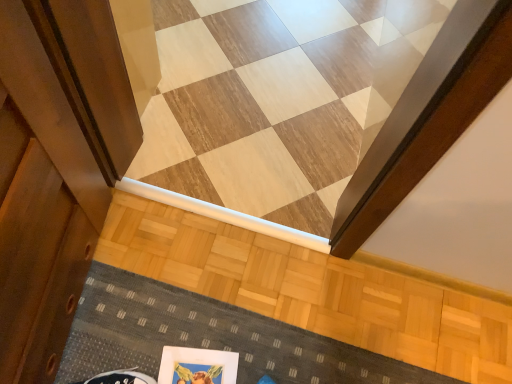
Locate an element on the screen. The width and height of the screenshot is (512, 384). matte white picture frame at lower center is located at coordinates (197, 366).

Measure the distance between textured gray doormat at lower center and camera.

textured gray doormat at lower center is 1.11 meters away from camera.

Where is `wooden floor at center`? Image resolution: width=512 pixels, height=384 pixels. wooden floor at center is located at coordinates (428, 116).

In the scene shown: Could you tell me if matte white picture frame at lower center is turned towards textured gray doormat at lower center?

Yes, matte white picture frame at lower center is facing textured gray doormat at lower center.

Is the depth of matte white picture frame at lower center less than that of textured gray doormat at lower center?

Yes, matte white picture frame at lower center is in front of textured gray doormat at lower center.

Between point (229, 367) and point (80, 374), which one is positioned in front?

Point (80, 374)

From a real-world perspective, is matte white picture frame at lower center physically located above or below textured gray doormat at lower center?

In terms of real-world spatial position, matte white picture frame at lower center is below textured gray doormat at lower center.

How many degrees apart are the facing directions of matte white picture frame at lower center and wooden floor at center?

12.9 degrees.

Between matte white picture frame at lower center and wooden floor at center, which one appears on the left side from the viewer's perspective?

From the viewer's perspective, matte white picture frame at lower center appears more on the left side.

Is matte white picture frame at lower center placed right next to wooden floor at center?

No, matte white picture frame at lower center is not in contact with wooden floor at center.

You are a GUI agent. You are given a task and a screenshot of the screen. Output one action in this format:
    pyautogui.click(x=<x>, y=<y>)
    Task: Click on the stairwell above the matte white picture frame at lower center (from the image's perspective)
    
    Given the screenshot: What is the action you would take?
    pyautogui.click(x=428, y=116)

Consider the image. Who is more distant, wooden floor at center or textured gray doormat at lower center?

wooden floor at center is behind.

Is textured gray doormat at lower center completely or partially inside wooden floor at center?

Actually, textured gray doormat at lower center is outside wooden floor at center.

From a real-world perspective, which object rests below the other?

In real-world perspective, textured gray doormat at lower center is lower.

Does wooden floor at center turn towards textured gray doormat at lower center?

Yes, wooden floor at center faces towards textured gray doormat at lower center.

In the scene shown: Is textured gray doormat at lower center positioned behind wooden floor at center?

No, the depth of textured gray doormat at lower center is less than that of wooden floor at center.

How many degrees apart are the facing directions of textured gray doormat at lower center and wooden floor at center?

Answer: 180 degrees separate the facing orientations of textured gray doormat at lower center and wooden floor at center.

Identify the location of stairwell on the left of the textured gray doormat at lower center. This screenshot has height=384, width=512. (428, 116).

From the image's perspective, does textured gray doormat at lower center appear higher than wooden floor at center?

Actually, textured gray doormat at lower center appears below wooden floor at center in the image.

In terms of width, does wooden floor at center look wider or thinner when compared to matte white picture frame at lower center?

wooden floor at center is wider than matte white picture frame at lower center.

Is wooden floor at center positioned with its back to matte white picture frame at lower center?

wooden floor at center does not have its back to matte white picture frame at lower center.

Consider the image. Would you say wooden floor at center is a long distance from matte white picture frame at lower center?

No, wooden floor at center is not far from matte white picture frame at lower center.

Considering the relative positions of textured gray doormat at lower center and matte white picture frame at lower center in the image provided, is textured gray doormat at lower center to the left or to the right of matte white picture frame at lower center?

From the image, it's evident that textured gray doormat at lower center is to the right of matte white picture frame at lower center.

Is textured gray doormat at lower center behind matte white picture frame at lower center?

Yes, it is.

Does textured gray doormat at lower center contain matte white picture frame at lower center?

Yes.

At what (x,y) coordinates should I click in order to perform the action: click on picture frame on the left of textured gray doormat at lower center. Please return your answer as a coordinate pair (x, y). The width and height of the screenshot is (512, 384). Looking at the image, I should click on (197, 366).

Where is `stairwell behind the matte white picture frame at lower center`? stairwell behind the matte white picture frame at lower center is located at coordinates tap(428, 116).

In the scene shown: When comparing their distances from textured gray doormat at lower center, does wooden floor at center or matte white picture frame at lower center seem closer?

matte white picture frame at lower center.

Based on their spatial positions, is matte white picture frame at lower center or textured gray doormat at lower center closer to wooden floor at center?

textured gray doormat at lower center lies closer to wooden floor at center than the other object.

When comparing their distances from matte white picture frame at lower center, does textured gray doormat at lower center or wooden floor at center seem closer?

textured gray doormat at lower center is closer to matte white picture frame at lower center.

Which object lies nearer to the anchor point matte white picture frame at lower center, wooden floor at center or textured gray doormat at lower center?

textured gray doormat at lower center lies closer to matte white picture frame at lower center than the other object.

Considering their positions, is matte white picture frame at lower center positioned closer to textured gray doormat at lower center than wooden floor at center?

matte white picture frame at lower center lies closer to textured gray doormat at lower center than the other object.

In the scene shown: When comparing their distances from wooden floor at center, does textured gray doormat at lower center or matte white picture frame at lower center seem closer?

Among the two, textured gray doormat at lower center is located nearer to wooden floor at center.

Locate an element on the screen. This screenshot has width=512, height=384. doormat that lies between wooden floor at center and matte white picture frame at lower center from top to bottom is located at coordinates (210, 337).